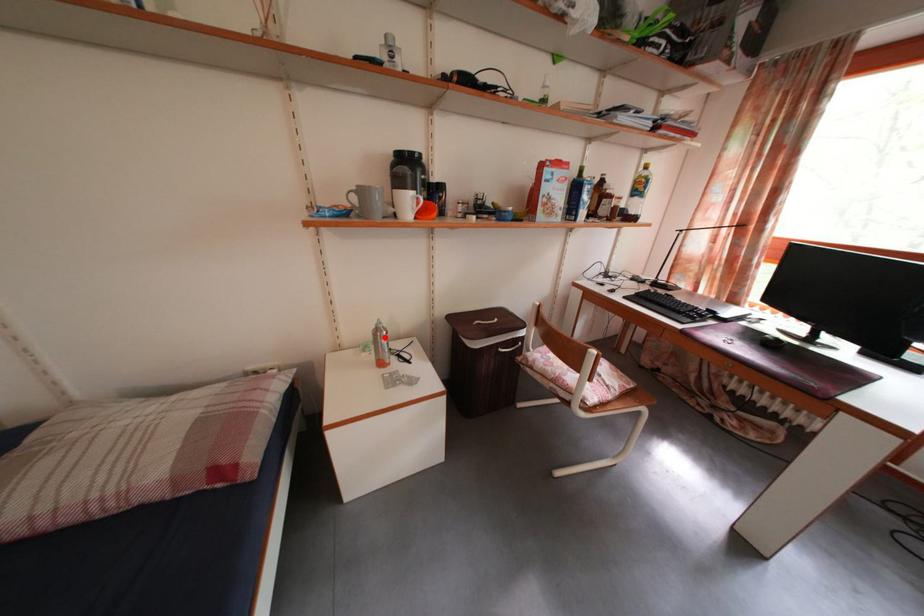
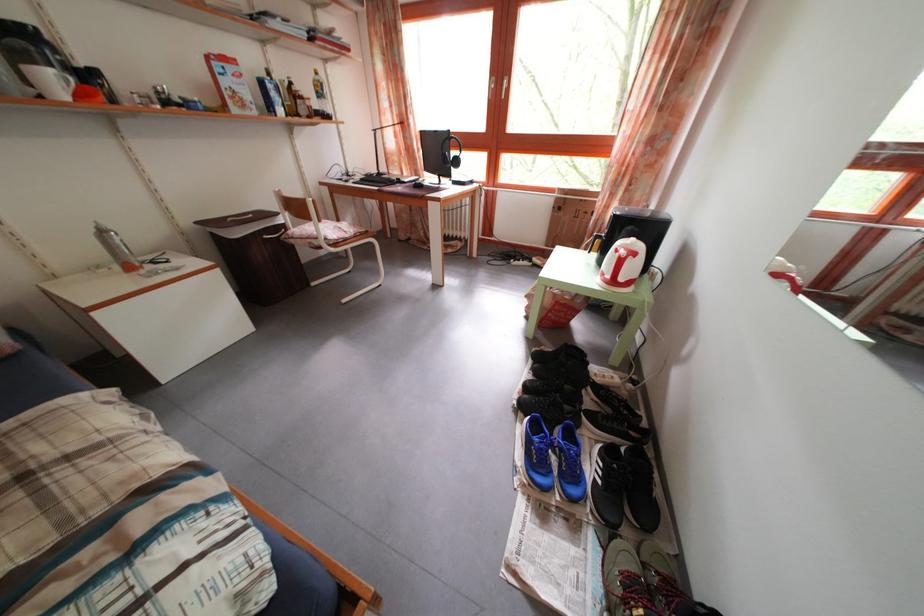
Find the pixel in the second image that matches the highlighted location in the first image.

(108, 238)